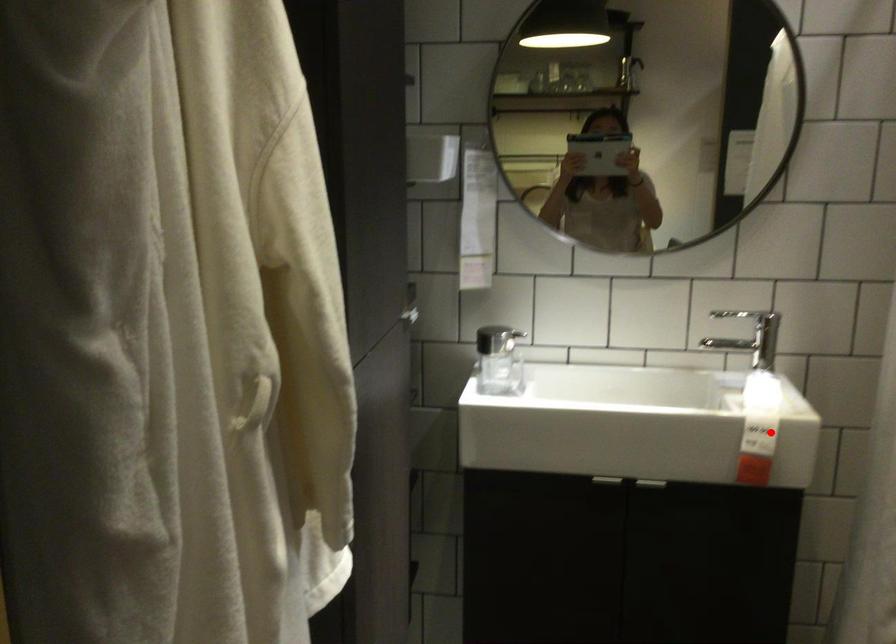
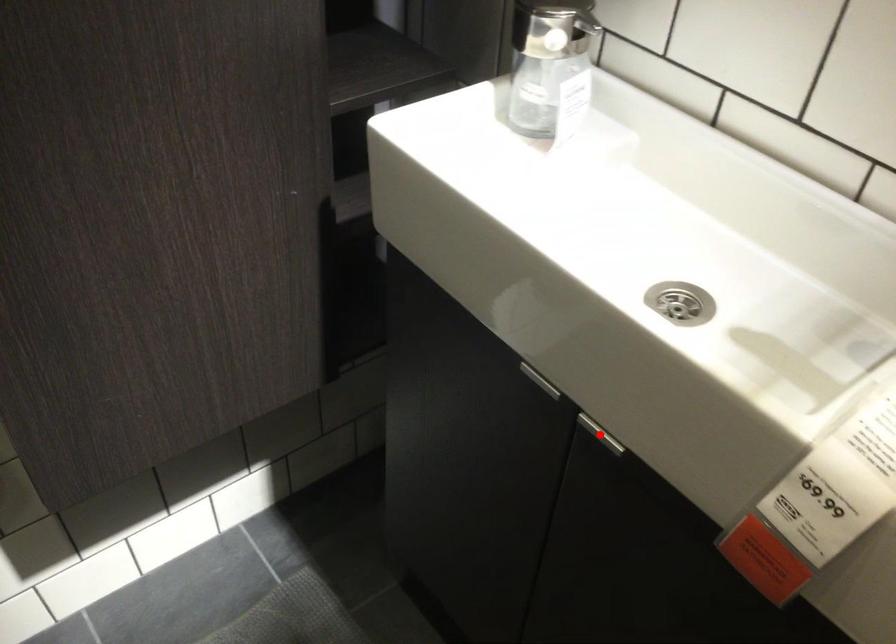
From the picture: I am providing you with two images of the same scene from different viewpoints. A red point is marked on the first image and another point is marked on the second image. Is the marked point in image1 the same physical position as the marked point in image2?

No